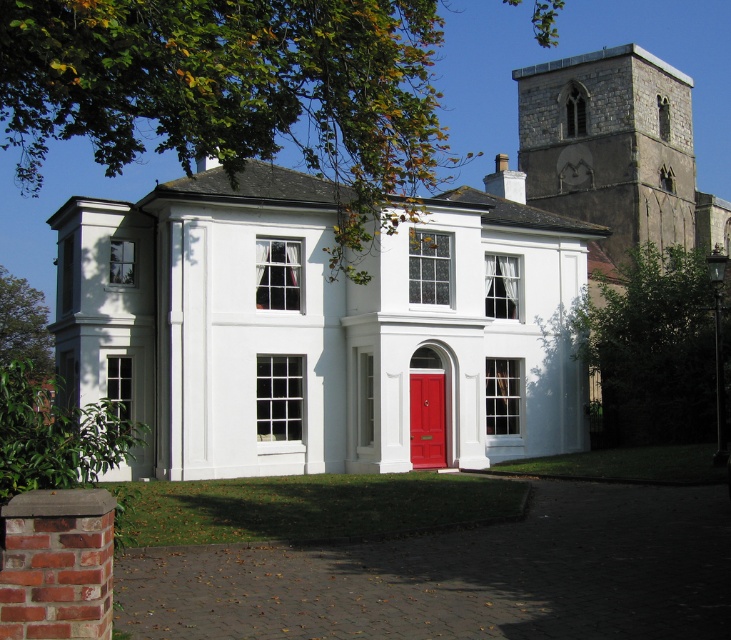
Can you confirm if stone tower at upper right is positioned below matte wood door at center?

Incorrect, stone tower at upper right is not positioned below matte wood door at center.

You are a GUI agent. You are given a task and a screenshot of the screen. Output one action in this format:
    pyautogui.click(x=<x>, y=<y>)
    Task: Click on the stone tower at upper right
    The width and height of the screenshot is (731, 640).
    Given the screenshot: What is the action you would take?
    pyautogui.click(x=376, y=291)

Where is `stone tower at upper right`? stone tower at upper right is located at coordinates (376, 291).